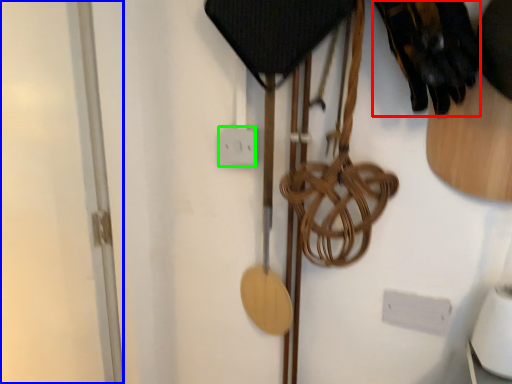
Question: Which object is positioned farthest from footwear (highlighted by a red box)? Select from glass door (highlighted by a blue box) and electric outlet (highlighted by a green box).

Choices:
 (A) glass door
 (B) electric outlet

Answer: (A)